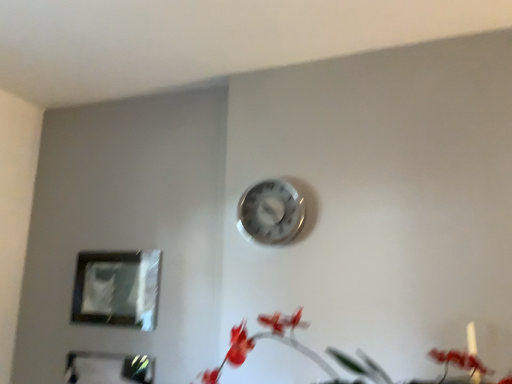
What do you see at coordinates (269, 338) in the screenshot? I see `matte red flowers at lower right` at bounding box center [269, 338].

Describe the element at coordinates (109, 368) in the screenshot. Image resolution: width=512 pixels, height=384 pixels. I see `metallic reflective frame at lower left, the 1th picture frame in the bottom-to-top sequence` at that location.

Where is `matte red flowers at lower right`? matte red flowers at lower right is located at coordinates (269, 338).

Does point (158, 289) come in front of point (280, 206)?

No, (158, 289) is further to viewer.

Is matte plastic picture frame at lower left, which appears as the 2th picture frame when ordered from the bottom, to the left or to the right of metallic silver clock at upper center in the image?

Based on their positions, matte plastic picture frame at lower left, which appears as the 2th picture frame when ordered from the bottom, is located to the left of metallic silver clock at upper center.

Is matte plastic picture frame at lower left, which appears as the 2th picture frame when ordered from the bottom, turned away from metallic silver clock at upper center?

matte plastic picture frame at lower left, which appears as the 2th picture frame when ordered from the bottom, does not have its back to metallic silver clock at upper center.

In the scene shown: Is matte plastic picture frame at lower left, which appears as the 2th picture frame when ordered from the bottom, wider than metallic silver clock at upper center?

No.

Is matte red flowers at lower right bigger than metallic silver clock at upper center?

Indeed, matte red flowers at lower right has a larger size compared to metallic silver clock at upper center.

How many degrees apart are the facing directions of matte red flowers at lower right and metallic silver clock at upper center?

There is a 0.722-degree angle between the facing directions of matte red flowers at lower right and metallic silver clock at upper center.

Where is `wall clock behind the matte red flowers at lower right`? The image size is (512, 384). wall clock behind the matte red flowers at lower right is located at coordinates (271, 212).

Which of these two, metallic silver clock at upper center or metallic reflective frame at lower left, placed as the 2th picture frame when sorted from top to bottom, stands shorter?

metallic silver clock at upper center is shorter.

From the picture: From the image's perspective, is metallic silver clock at upper center below metallic reflective frame at lower left, placed as the 2th picture frame when sorted from top to bottom?

No, from the image's perspective, metallic silver clock at upper center is not below metallic reflective frame at lower left, placed as the 2th picture frame when sorted from top to bottom.

Considering the relative positions of metallic silver clock at upper center and metallic reflective frame at lower left, the 1th picture frame in the bottom-to-top sequence, in the image provided, is metallic silver clock at upper center to the right of metallic reflective frame at lower left, the 1th picture frame in the bottom-to-top sequence, from the viewer's perspective?

Indeed, metallic silver clock at upper center is positioned on the right side of metallic reflective frame at lower left, the 1th picture frame in the bottom-to-top sequence.

Is metallic silver clock at upper center positioned with its back to metallic reflective frame at lower left, placed as the 2th picture frame when sorted from top to bottom?

No, metallic reflective frame at lower left, placed as the 2th picture frame when sorted from top to bottom, is not at the back of metallic silver clock at upper center.

Considering the relative sizes of metallic reflective frame at lower left, the 1th picture frame in the bottom-to-top sequence, and matte red flowers at lower right in the image provided, is metallic reflective frame at lower left, the 1th picture frame in the bottom-to-top sequence, shorter than matte red flowers at lower right?

No.

From the image's perspective, who appears lower, metallic reflective frame at lower left, the 1th picture frame in the bottom-to-top sequence, or matte red flowers at lower right?

metallic reflective frame at lower left, the 1th picture frame in the bottom-to-top sequence, appears lower in the image.

Is metallic reflective frame at lower left, placed as the 2th picture frame when sorted from top to bottom, situated inside matte red flowers at lower right or outside?

metallic reflective frame at lower left, placed as the 2th picture frame when sorted from top to bottom, is outside matte red flowers at lower right.

Can you confirm if metallic silver clock at upper center is shorter than matte plastic picture frame at lower left, which appears as the 2th picture frame when ordered from the bottom?

Yes, metallic silver clock at upper center is shorter than matte plastic picture frame at lower left, which appears as the 2th picture frame when ordered from the bottom.

Considering the points (275, 237) and (138, 327), which point is behind, point (275, 237) or point (138, 327)?

Point (138, 327)

Based on the photo, is metallic silver clock at upper center positioned with its back to matte plastic picture frame at lower left, which appears as the 2th picture frame when ordered from the bottom?

No, metallic silver clock at upper center is not facing away from matte plastic picture frame at lower left, which appears as the 2th picture frame when ordered from the bottom.

Locate an element on the screen. The height and width of the screenshot is (384, 512). the 2nd picture frame behind the metallic silver clock at upper center is located at coordinates (117, 289).

In terms of height, does metallic reflective frame at lower left, the 1th picture frame in the bottom-to-top sequence, look taller or shorter compared to metallic silver clock at upper center?

metallic reflective frame at lower left, the 1th picture frame in the bottom-to-top sequence, is taller than metallic silver clock at upper center.

Is point (148, 383) farther from viewer compared to point (270, 202)?

Yes, it is.

How far apart are metallic reflective frame at lower left, the 1th picture frame in the bottom-to-top sequence, and metallic silver clock at upper center?

metallic reflective frame at lower left, the 1th picture frame in the bottom-to-top sequence, is 29.74 inches from metallic silver clock at upper center.

Is metallic reflective frame at lower left, placed as the 2th picture frame when sorted from top to bottom, with metallic silver clock at upper center?

No.

From a real-world perspective, is metallic silver clock at upper center over matte red flowers at lower right?

Yes.

Considering the points (288, 210) and (309, 352), which point is behind, point (288, 210) or point (309, 352)?

Point (288, 210)

Considering the relative sizes of metallic silver clock at upper center and matte red flowers at lower right in the image provided, is metallic silver clock at upper center wider than matte red flowers at lower right?

No, metallic silver clock at upper center is not wider than matte red flowers at lower right.

Is metallic silver clock at upper center to the left of matte red flowers at lower right from the viewer's perspective?

Yes.

Starting from the metallic silver clock at upper center, which picture frame is the 1st one to the left? Please provide its 2D coordinates.

[(117, 289)]

Where is `floral arrangement below the metallic silver clock at upper center (from the image's perspective)`? The height and width of the screenshot is (384, 512). floral arrangement below the metallic silver clock at upper center (from the image's perspective) is located at coordinates (269, 338).

Based on their spatial positions, is matte plastic picture frame at lower left, which appears as the 2th picture frame when ordered from the bottom, or metallic reflective frame at lower left, placed as the 2th picture frame when sorted from top to bottom, closer to metallic silver clock at upper center?

matte plastic picture frame at lower left, which appears as the 2th picture frame when ordered from the bottom.

Looking at the image, which one is located further to metallic reflective frame at lower left, the 1th picture frame in the bottom-to-top sequence, matte plastic picture frame at lower left, the first picture frame positioned from the top, or metallic silver clock at upper center?

Based on the image, metallic silver clock at upper center appears to be further to metallic reflective frame at lower left, the 1th picture frame in the bottom-to-top sequence.

Looking at the image, which one is located closer to matte plastic picture frame at lower left, which appears as the 2th picture frame when ordered from the bottom, metallic silver clock at upper center or matte red flowers at lower right?

Among the two, matte red flowers at lower right is located nearer to matte plastic picture frame at lower left, which appears as the 2th picture frame when ordered from the bottom.

Considering their positions, is matte plastic picture frame at lower left, which appears as the 2th picture frame when ordered from the bottom, positioned further to matte red flowers at lower right than metallic silver clock at upper center?

Among the two, matte plastic picture frame at lower left, which appears as the 2th picture frame when ordered from the bottom, is located further to matte red flowers at lower right.

Estimate the real-world distances between objects in this image. Which object is further from metallic reflective frame at lower left, placed as the 2th picture frame when sorted from top to bottom, matte plastic picture frame at lower left, which appears as the 2th picture frame when ordered from the bottom, or matte red flowers at lower right?

Based on the image, matte red flowers at lower right appears to be further to metallic reflective frame at lower left, placed as the 2th picture frame when sorted from top to bottom.

From the image, which object appears to be farther from metallic silver clock at upper center, matte red flowers at lower right or metallic reflective frame at lower left, the 1th picture frame in the bottom-to-top sequence?

metallic reflective frame at lower left, the 1th picture frame in the bottom-to-top sequence, is positioned further to the anchor metallic silver clock at upper center.

Estimate the real-world distances between objects in this image. Which object is further from metallic reflective frame at lower left, placed as the 2th picture frame when sorted from top to bottom, metallic silver clock at upper center or matte plastic picture frame at lower left, the first picture frame positioned from the top?

Among the two, metallic silver clock at upper center is located further to metallic reflective frame at lower left, placed as the 2th picture frame when sorted from top to bottom.

Considering their positions, is metallic reflective frame at lower left, the 1th picture frame in the bottom-to-top sequence, positioned closer to matte red flowers at lower right than matte plastic picture frame at lower left, which appears as the 2th picture frame when ordered from the bottom?

metallic reflective frame at lower left, the 1th picture frame in the bottom-to-top sequence, lies closer to matte red flowers at lower right than the other object.

You are a GUI agent. You are given a task and a screenshot of the screen. Output one action in this format:
    pyautogui.click(x=<x>, y=<y>)
    Task: Click on the wall clock between matte red flowers at lower right and metallic reflective frame at lower left, the 1th picture frame in the bottom-to-top sequence, in the front-back direction
    
    Given the screenshot: What is the action you would take?
    pyautogui.click(x=271, y=212)

This screenshot has width=512, height=384. I want to click on wall clock between matte red flowers at lower right and matte plastic picture frame at lower left, which appears as the 2th picture frame when ordered from the bottom, along the z-axis, so click(x=271, y=212).

Image resolution: width=512 pixels, height=384 pixels. I want to click on picture frame between metallic reflective frame at lower left, placed as the 2th picture frame when sorted from top to bottom, and metallic silver clock at upper center from left to right, so click(117, 289).

Identify the location of picture frame located between matte red flowers at lower right and matte plastic picture frame at lower left, the first picture frame positioned from the top, in the depth direction. The height and width of the screenshot is (384, 512). (109, 368).